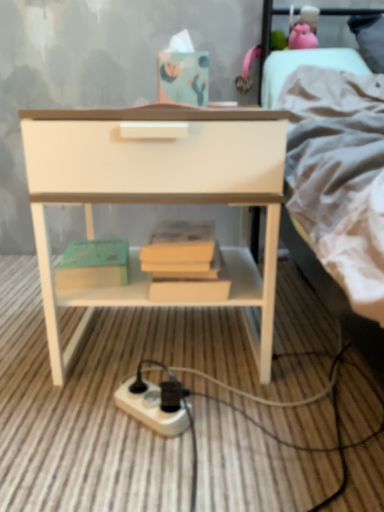
Identify the location of vacant space in front of white glossy nightstand at center. The height and width of the screenshot is (512, 384). (172, 446).